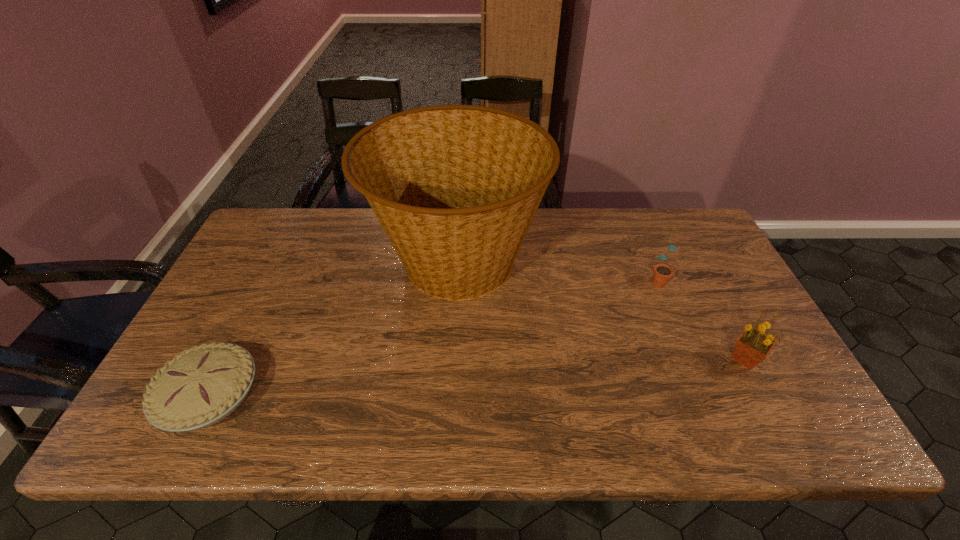
The width and height of the screenshot is (960, 540). Find the location of `the third object from right to left`. the third object from right to left is located at coordinates (455, 187).

Where is `basket`? This screenshot has width=960, height=540. basket is located at coordinates (455, 187).

Locate an element on the screen. the third object from left to right is located at coordinates (662, 272).

In order to click on the farther sunflower in this screenshot , I will do `click(662, 272)`.

This screenshot has height=540, width=960. Identify the location of the nearer sunflower. (753, 346).

What are the coordinates of `the right sunflower` in the screenshot? It's located at (753, 346).

Locate an element on the screen. The height and width of the screenshot is (540, 960). pie is located at coordinates [203, 385].

Identify the location of the leftmost object. The height and width of the screenshot is (540, 960). (203, 385).

At what (x,y) coordinates should I click in order to perform the action: click on blank space located on the front of the second object from left to right. Please return your answer as a coordinate pair (x, y). Looking at the image, I should click on (450, 377).

At what (x,y) coordinates should I click in order to perform the action: click on free spot located 0.210m on the flower of the second object from right to left. Please return your answer as a coordinate pair (x, y). This screenshot has height=540, width=960. Looking at the image, I should click on (686, 348).